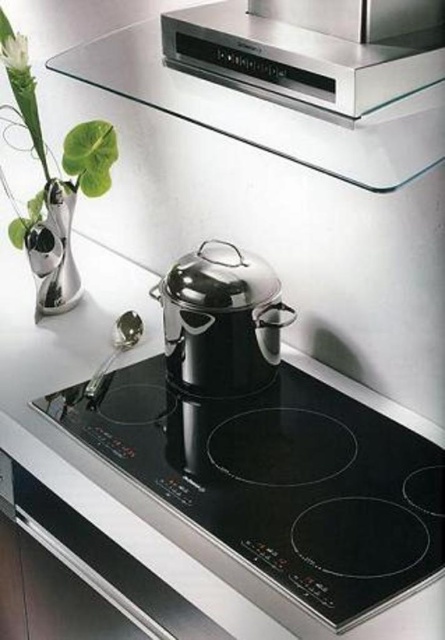
You are standing in front of the kitchen countertop and want to reach both points. Which point, point (250,26) or point (75,128), is closer to you?

Point (250,26) is closer to the camera than point (75,128), so it is closer to you.

You are a chef trying to place a 20 inch ruler horizontally between the satin silver range hood at upper center and the green leafy plant at left. Will the ruler fit without overlapping either object?

The distance between the satin silver range hood at upper center and the green leafy plant at left is 19.87 inches. Since the ruler is 20 inches long, it will not fit as the space is slightly shorter than the ruler.